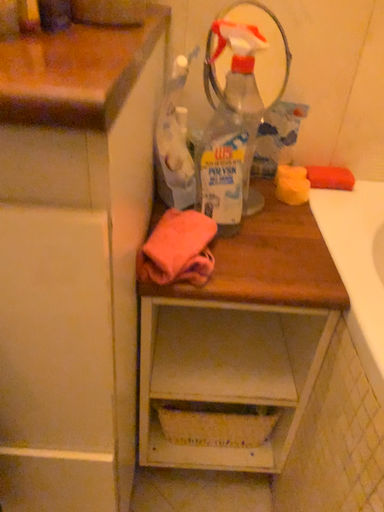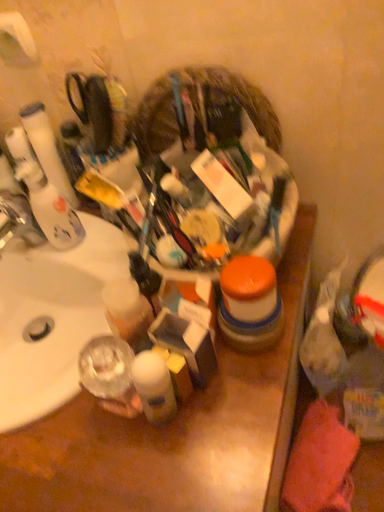
Question: How did the camera likely rotate when shooting the video?

Choices:
 (A) rotated downward
 (B) rotated upward

Answer: (A)